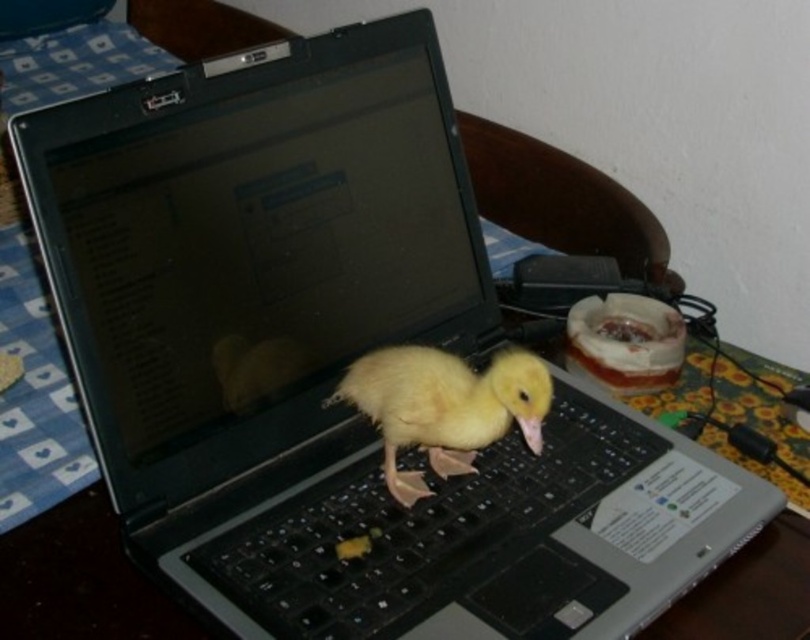
Looking at this image, is black plastic keyboard at center closer to the viewer compared to yellow downy duckling at center?

Yes, it is in front of yellow downy duckling at center.

Locate an element on the screen. The height and width of the screenshot is (640, 810). black plastic keyboard at center is located at coordinates (438, 538).